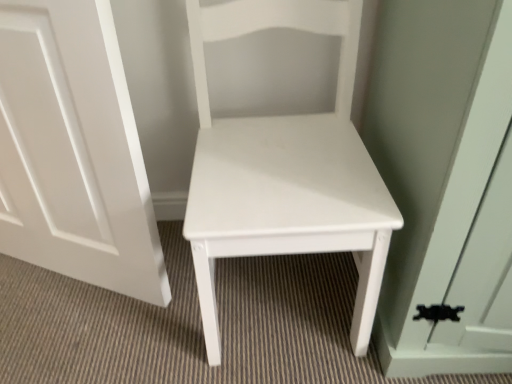
This screenshot has width=512, height=384. Describe the element at coordinates (285, 169) in the screenshot. I see `white matte chair at center` at that location.

Locate an element on the screen. white matte chair at center is located at coordinates (285, 169).

This screenshot has width=512, height=384. Describe the element at coordinates (74, 151) in the screenshot. I see `white matte door at center` at that location.

Identify the location of white matte door at center. (74, 151).

This screenshot has width=512, height=384. I want to click on white matte chair at center, so click(285, 169).

Considering the positions of objects white matte door at center and white matte chair at center in the image provided, who is more to the left, white matte door at center or white matte chair at center?

white matte door at center.

Does white matte door at center lie behind white matte chair at center?

That is True.

Does point (75, 221) appear closer or farther from the camera than point (354, 231)?

Clearly, point (75, 221) is more distant from the camera than point (354, 231).

From the image's perspective, is white matte door at center over white matte chair at center?

Yes, from the image's perspective, white matte door at center is on top of white matte chair at center.

Consider the image. From a real-world perspective, which object rests below the other?

white matte door at center.

Considering the relative sizes of white matte door at center and white matte chair at center in the image provided, is white matte door at center wider than white matte chair at center?

No, white matte door at center is not wider than white matte chair at center.

Can you confirm if white matte door at center is taller than white matte chair at center?

Incorrect, the height of white matte door at center is not larger of that of white matte chair at center.

Considering the relative sizes of white matte door at center and white matte chair at center in the image provided, is white matte door at center smaller than white matte chair at center?

Indeed, white matte door at center has a smaller size compared to white matte chair at center.

Would you say white matte door at center contains white matte chair at center?

Actually, white matte chair at center is outside white matte door at center.

Is the surface of white matte door at center in direct contact with white matte chair at center?

No, white matte door at center is not next to white matte chair at center.

Is white matte door at center aimed at white matte chair at center?

No.

What's the angular difference between white matte door at center and white matte chair at center's facing directions?

The angular difference between white matte door at center and white matte chair at center is 23.7 degrees.

Image resolution: width=512 pixels, height=384 pixels. I want to click on door behind the white matte chair at center, so click(74, 151).

Considering the positions of objects white matte chair at center and white matte door at center in the image provided, who is more to the left, white matte chair at center or white matte door at center?

white matte door at center is more to the left.

Which object is further away from the camera taking this photo, white matte chair at center or white matte door at center?

white matte door at center.

Which point is more distant from viewer, (231, 165) or (0, 9)?

The point (231, 165) is farther.

Based on the photo, from the image's perspective, is white matte chair at center above or below white matte door at center?

white matte chair at center is situated lower than white matte door at center in the image.

From a real-world perspective, who is located lower, white matte chair at center or white matte door at center?

In real-world perspective, white matte door at center is lower.

Can you confirm if white matte chair at center is wider than white matte door at center?

Yes, white matte chair at center is wider than white matte door at center.

Considering the sizes of white matte chair at center and white matte door at center in the image, is white matte chair at center taller or shorter than white matte door at center?

white matte chair at center is taller than white matte door at center.

From the picture: Which of these two, white matte chair at center or white matte door at center, is bigger?

With larger size is white matte chair at center.

Do you think white matte chair at center is within white matte door at center, or outside of it?

white matte chair at center is not inside white matte door at center, it's outside.

Is white matte chair at center next to white matte door at center?

No.

Is white matte chair at center positioned with its back to white matte door at center?

white matte chair at center is not turned away from white matte door at center.

At what (x,y) coordinates should I click in order to perform the action: click on door that appears above the white matte chair at center (from the image's perspective). Please return your answer as a coordinate pair (x, y). The width and height of the screenshot is (512, 384). Looking at the image, I should click on (74, 151).

Find the location of a particular element. furniture that is in front of the white matte door at center is located at coordinates (285, 169).

Where is `furniture on the right of the white matte door at center`? furniture on the right of the white matte door at center is located at coordinates (285, 169).